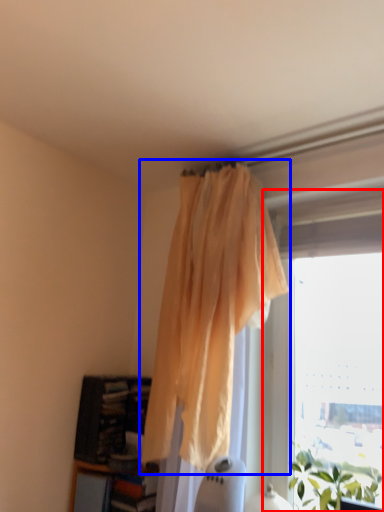
Question: Which object appears farthest to the camera in this image, window (highlighted by a red box) or curtain (highlighted by a blue box)?

Choices:
 (A) window
 (B) curtain

Answer: (A)